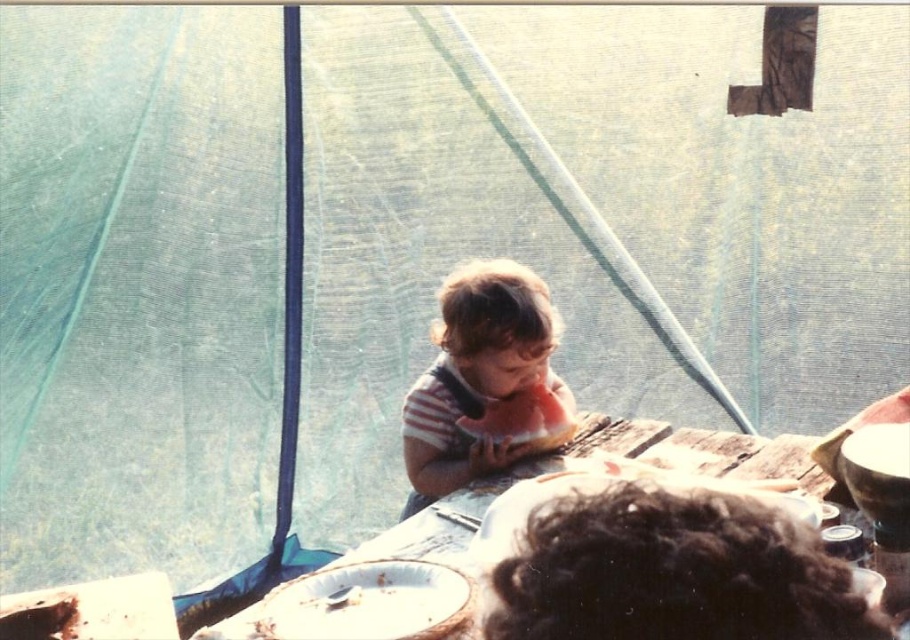
Can you confirm if striped cotton shirt at center is shorter than wooden table at center?

Incorrect, striped cotton shirt at center's height does not fall short of wooden table at center's.

Who is more distant from viewer, [532,336] or [209,636]?

Point [532,336]

This screenshot has width=910, height=640. I want to click on striped cotton shirt at center, so tap(476, 374).

Is striped cotton shirt at center taller than red matte watermelon at center?

Indeed, striped cotton shirt at center has a greater height compared to red matte watermelon at center.

Between point (426, 372) and point (534, 449), which one is positioned behind?

The point (426, 372) is behind.

The image size is (910, 640). What are the coordinates of `striped cotton shirt at center` in the screenshot? It's located at (476, 374).

Between wooden table at center and red matte watermelon at center, which one has more height?

With more height is wooden table at center.

What do you see at coordinates (743, 456) in the screenshot?
I see `wooden table at center` at bounding box center [743, 456].

Does point (355, 554) lie behind point (554, 432)?

No, (355, 554) is closer to viewer.

The height and width of the screenshot is (640, 910). In order to click on wooden table at center in this screenshot , I will do `click(743, 456)`.